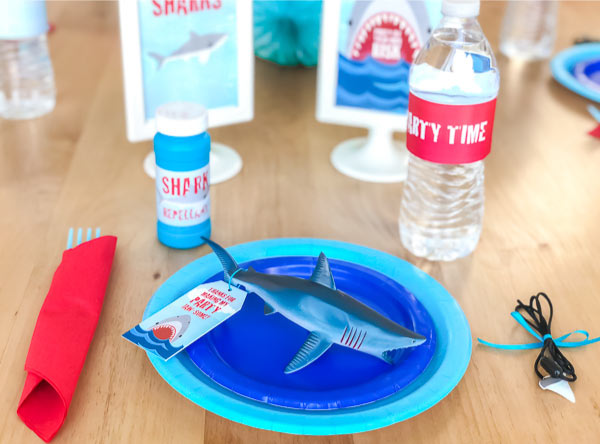
The image size is (600, 444). Identify the location of wood table. (549, 227).